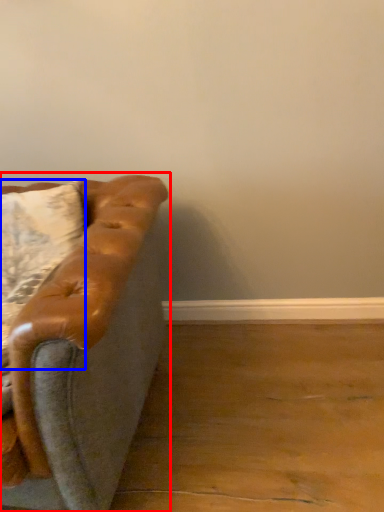
Question: Which object appears closest to the camera in this image, studio couch (highlighted by a red box) or pillow (highlighted by a blue box)?

Choices:
 (A) studio couch
 (B) pillow

Answer: (A)